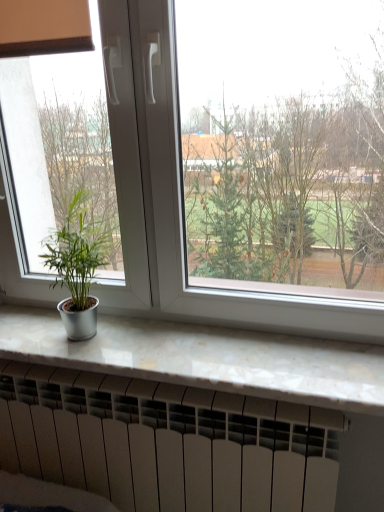
Locate an element on the screen. Image resolution: width=384 pixels, height=512 pixels. free space above white matte heater at bottom (from a real-world perspective) is located at coordinates pos(146,388).